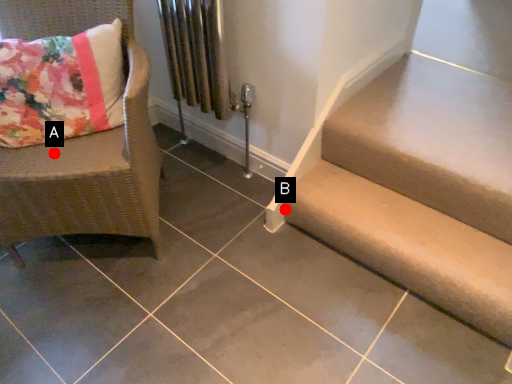
Question: Two points are circled on the image, labeled by A and B beside each circle. Among these points, which one is nearest to the camera?

Choices:
 (A) A is closer
 (B) B is closer

Answer: (A)